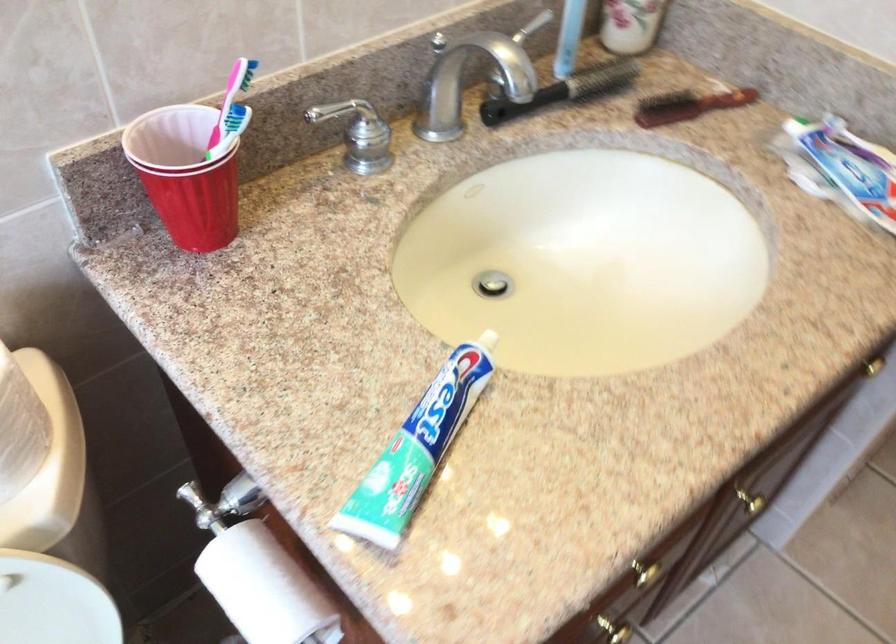
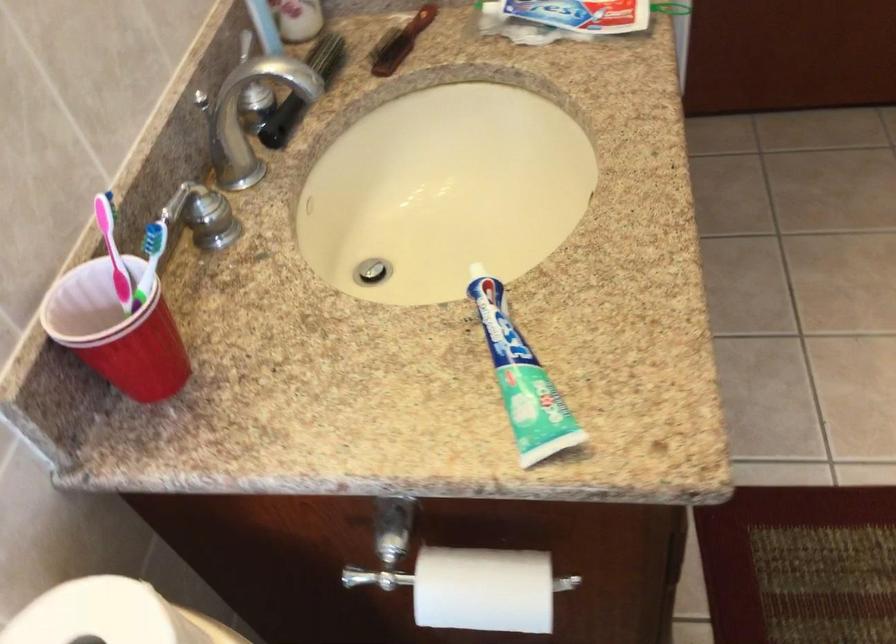
Locate, in the second image, the point that corresponds to (164,169) in the first image.

(116, 330)